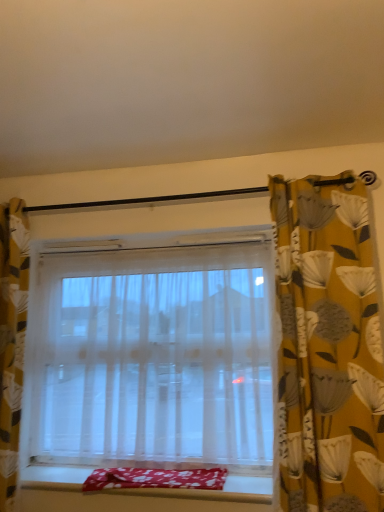
Question: Is transparent fabric window at center at the right side of yellow floral fabric curtain at right, the first curtain in the right-to-left sequence?

Choices:
 (A) no
 (B) yes

Answer: (A)

Question: Considering the relative sizes of transparent fabric window at center and yellow floral fabric curtain at right, the first curtain in the right-to-left sequence, in the image provided, is transparent fabric window at center wider than yellow floral fabric curtain at right, the first curtain in the right-to-left sequence,?

Choices:
 (A) yes
 (B) no

Answer: (A)

Question: From a real-world perspective, is transparent fabric window at center located higher than yellow floral fabric curtain at right, the 2th curtain when ordered from left to right?

Choices:
 (A) no
 (B) yes

Answer: (A)

Question: Are transparent fabric window at center and yellow floral fabric curtain at right, the 2th curtain when ordered from left to right, making contact?

Choices:
 (A) no
 (B) yes

Answer: (A)

Question: From the image's perspective, is transparent fabric window at center on top of yellow floral fabric curtain at right, the first curtain in the right-to-left sequence?

Choices:
 (A) yes
 (B) no

Answer: (B)

Question: Is yellow floral fabric curtain at right, the 2th curtain when ordered from left to right, at the back of transparent fabric window at center?

Choices:
 (A) no
 (B) yes

Answer: (A)

Question: From a real-world perspective, is yellow floral fabric curtain at left, which is the first curtain from left to right, beneath floral cotton blanket at lower center?

Choices:
 (A) no
 (B) yes

Answer: (A)

Question: Can you confirm if yellow floral fabric curtain at left, marked as the second curtain in a right-to-left arrangement, is positioned to the right of floral cotton blanket at lower center?

Choices:
 (A) no
 (B) yes

Answer: (A)

Question: Is yellow floral fabric curtain at left, which is the first curtain from left to right, turned away from floral cotton blanket at lower center?

Choices:
 (A) yes
 (B) no

Answer: (B)

Question: Is yellow floral fabric curtain at left, which is the first curtain from left to right, wider than floral cotton blanket at lower center?

Choices:
 (A) no
 (B) yes

Answer: (A)

Question: Does yellow floral fabric curtain at left, marked as the second curtain in a right-to-left arrangement, appear on the left side of floral cotton blanket at lower center?

Choices:
 (A) no
 (B) yes

Answer: (B)

Question: Does yellow floral fabric curtain at left, which is the first curtain from left to right, come in front of floral cotton blanket at lower center?

Choices:
 (A) yes
 (B) no

Answer: (A)

Question: From the image's perspective, is smooth fabric window sill at lower center located above yellow floral fabric curtain at left, which is the first curtain from left to right?

Choices:
 (A) no
 (B) yes

Answer: (A)